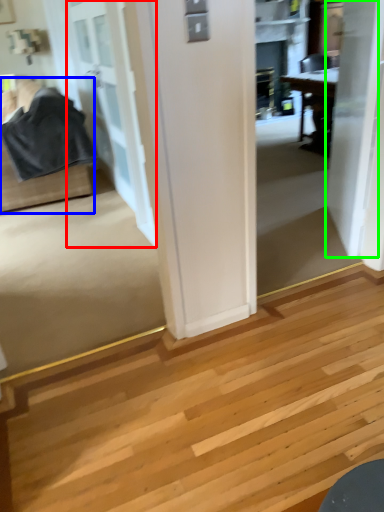
Question: Based on their relative distances, which object is farther from door (highlighted by a red box)? Choose from furniture (highlighted by a blue box) and door (highlighted by a green box).

Choices:
 (A) furniture
 (B) door

Answer: (B)